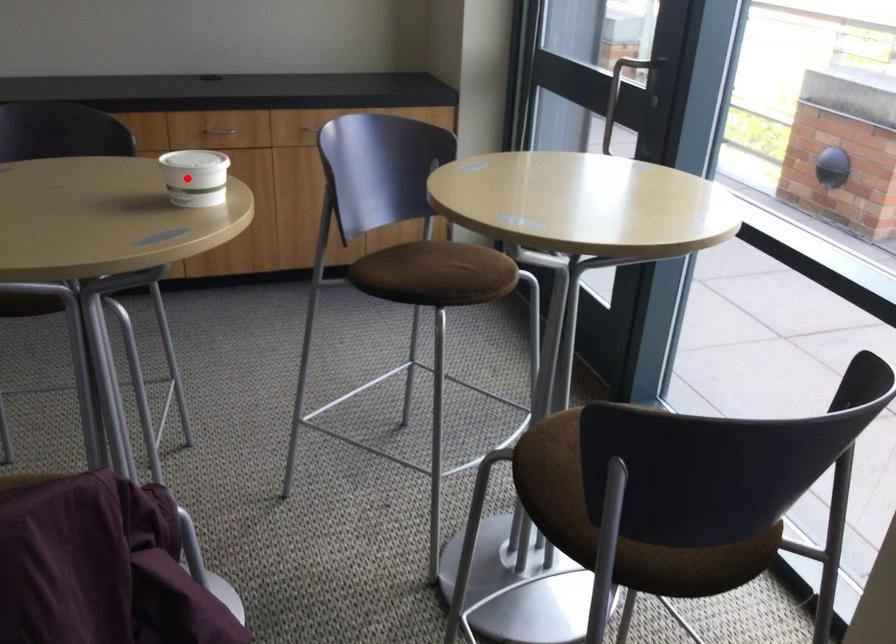
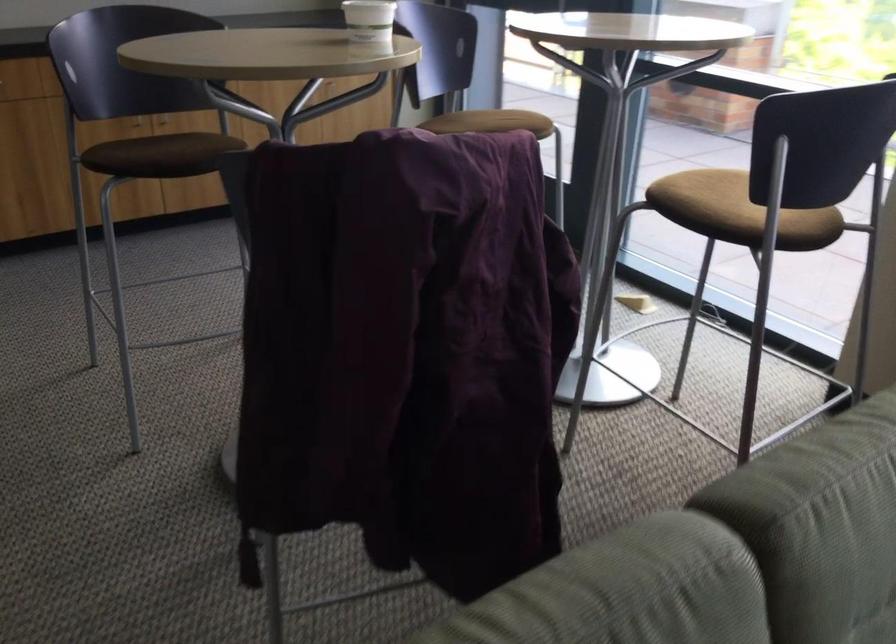
The point at the highlighted location is marked in the first image. Where is the corresponding point in the second image?

(368, 20)